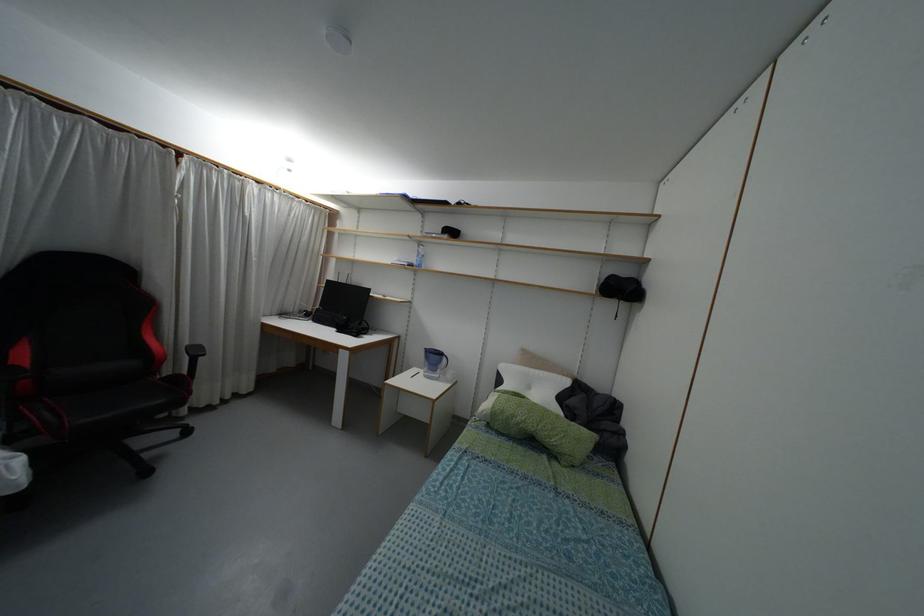
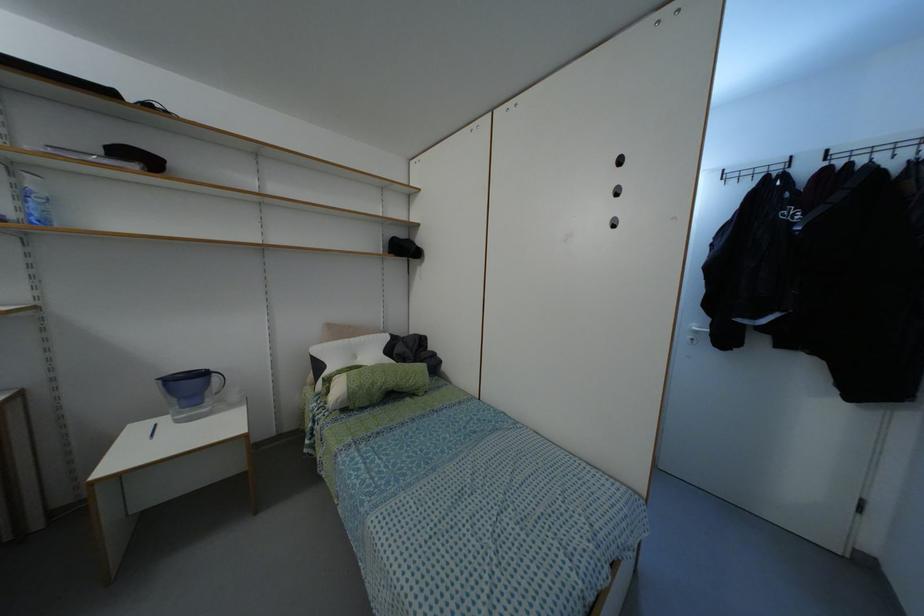
Question: The first image is from the beginning of the video and the second image is from the end. How did the camera likely rotate when shooting the video?

Choices:
 (A) Left
 (B) Right
 (C) Up
 (D) Down

Answer: (B)